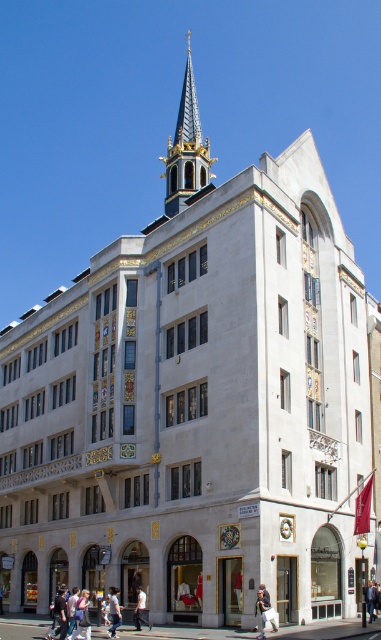
From the picture: You are standing in front of the building and notice an object at point (113,611). What is located at that point?

The light blue jeans at lower center are located at point (113,611).